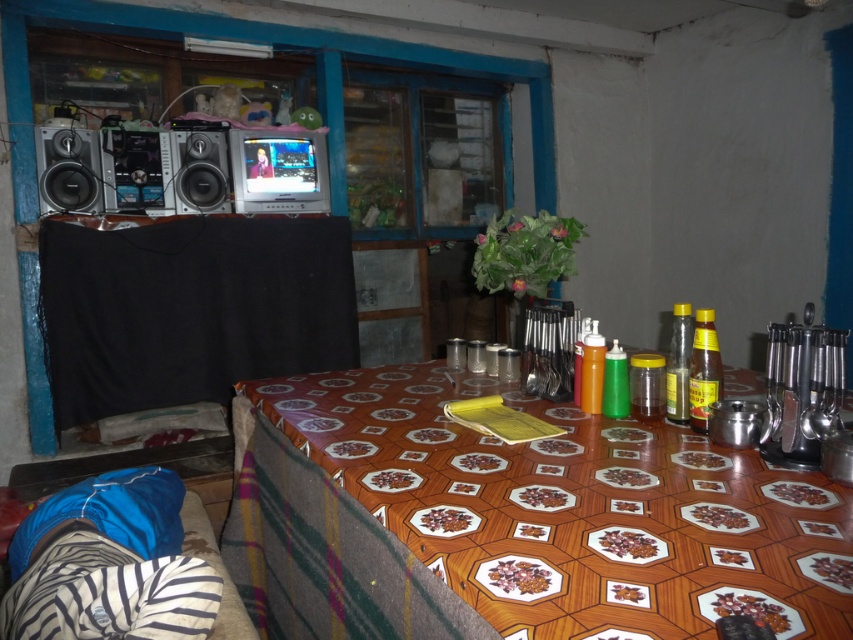
You are standing in the room and want to place a new plant pot between the wooden table at center and the black fabric at left. Based on their positions, which object should the plant pot be closer to?

The wooden table at center is to the right of the black fabric at left, so the plant pot should be placed closer to the black fabric at left to maintain symmetry between the two objects.

You are organizing a small party in the room and need to place a large centerpiece on the wooden table at center. Given that the satin silver speaker at upper left is already placed on the table, will there be enough space for the centerpiece?

The wooden table at center is larger in size than the satin silver speaker at upper left, so there should be enough space to place a large centerpiece on the table alongside the speaker.